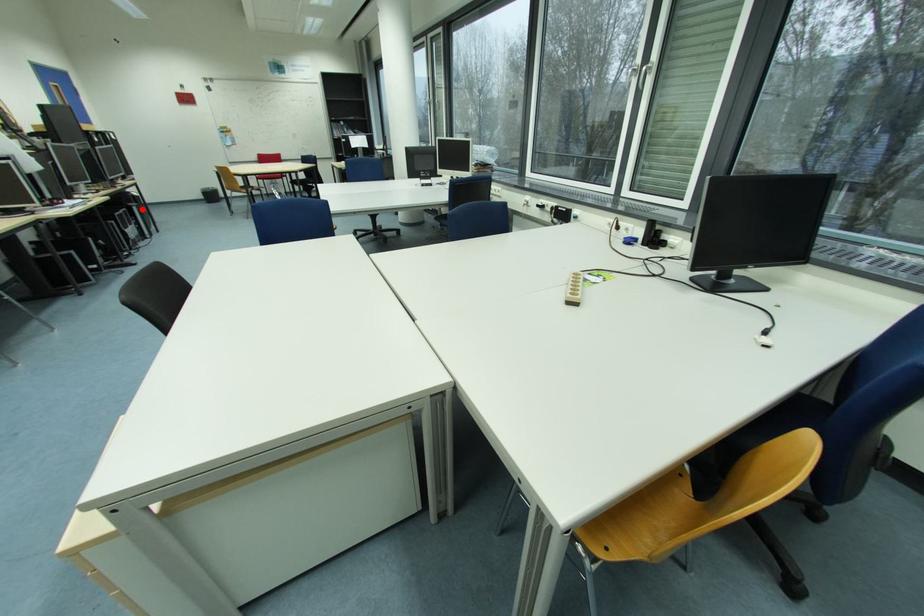
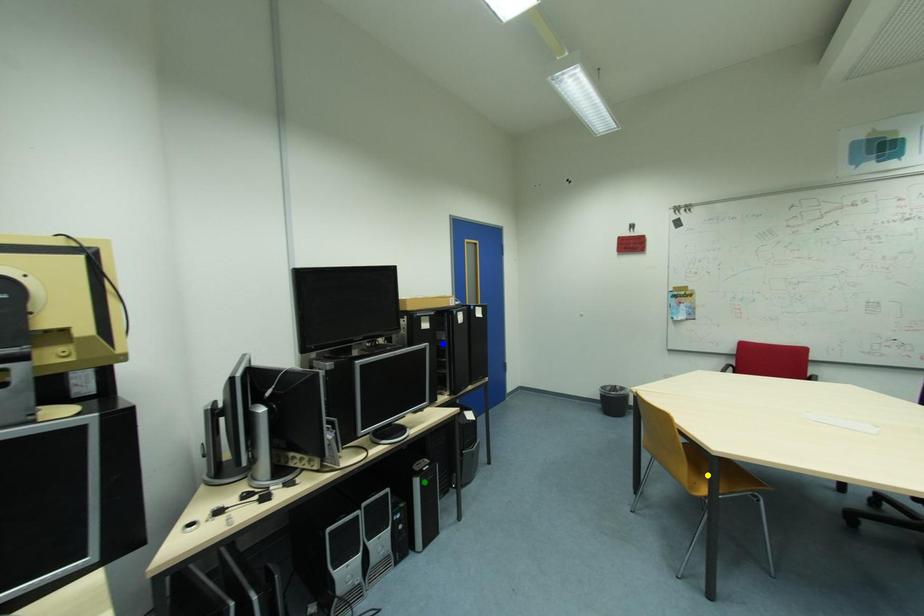
Question: I am providing you with two images of the same scene from different viewpoints. A red point is marked on the first image. You are given multiple points on the second image. Which point in image 2 is actually the same real-world point as the red point in image 1?

Choices:
 (A) green point
 (B) blue point
 (C) yellow point

Answer: (A)